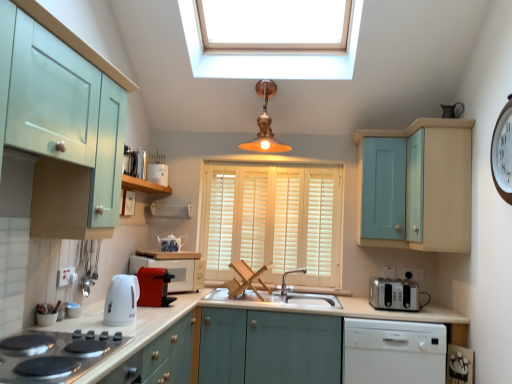
Question: Can you see white matte exhaust hood at upper center touching matte light blue cabinet at left, the first cabinetry in the left-to-right sequence?

Choices:
 (A) no
 (B) yes

Answer: (A)

Question: Does white matte exhaust hood at upper center come behind matte light blue cabinet at left, the first cabinetry in the left-to-right sequence?

Choices:
 (A) no
 (B) yes

Answer: (B)

Question: Are white matte exhaust hood at upper center and matte light blue cabinet at left, the first cabinetry in the left-to-right sequence, located far from each other?

Choices:
 (A) yes
 (B) no

Answer: (A)

Question: Is white matte exhaust hood at upper center positioned in front of matte light blue cabinet at left, the first cabinetry in the left-to-right sequence?

Choices:
 (A) yes
 (B) no

Answer: (B)

Question: From the image's perspective, is white matte exhaust hood at upper center above matte light blue cabinet at left, the first cabinetry in the left-to-right sequence?

Choices:
 (A) yes
 (B) no

Answer: (B)

Question: From the image's perspective, would you say white matte exhaust hood at upper center is shown under matte light blue cabinet at left, the first cabinetry in the left-to-right sequence?

Choices:
 (A) no
 (B) yes

Answer: (B)

Question: From the image's perspective, does white matte exhaust hood at upper center appear higher than teal wooden cabinet at upper right?

Choices:
 (A) no
 (B) yes

Answer: (A)

Question: Considering the relative positions of white matte exhaust hood at upper center and teal wooden cabinet at upper right in the image provided, is white matte exhaust hood at upper center in front of teal wooden cabinet at upper right?

Choices:
 (A) yes
 (B) no

Answer: (B)

Question: Is teal wooden cabinet at upper right completely or partially inside white matte exhaust hood at upper center?

Choices:
 (A) yes
 (B) no

Answer: (B)

Question: Is white matte exhaust hood at upper center wider than teal wooden cabinet at upper right?

Choices:
 (A) yes
 (B) no

Answer: (B)

Question: From a real-world perspective, is white matte exhaust hood at upper center below teal wooden cabinet at upper right?

Choices:
 (A) no
 (B) yes

Answer: (B)

Question: Can you confirm if white matte exhaust hood at upper center is positioned to the left of teal wooden cabinet at upper right?

Choices:
 (A) yes
 (B) no

Answer: (A)

Question: Is light blue wood cabinet at upper right, the second cabinetry from the top, not within white ceramic toaster at center, the 3th appliance from the bottom?

Choices:
 (A) no
 (B) yes

Answer: (B)